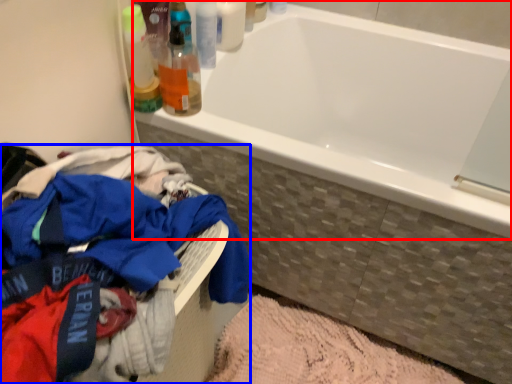
Question: Which object appears farthest to the camera in this image, bathtub (highlighted by a red box) or clothing (highlighted by a blue box)?

Choices:
 (A) bathtub
 (B) clothing

Answer: (A)